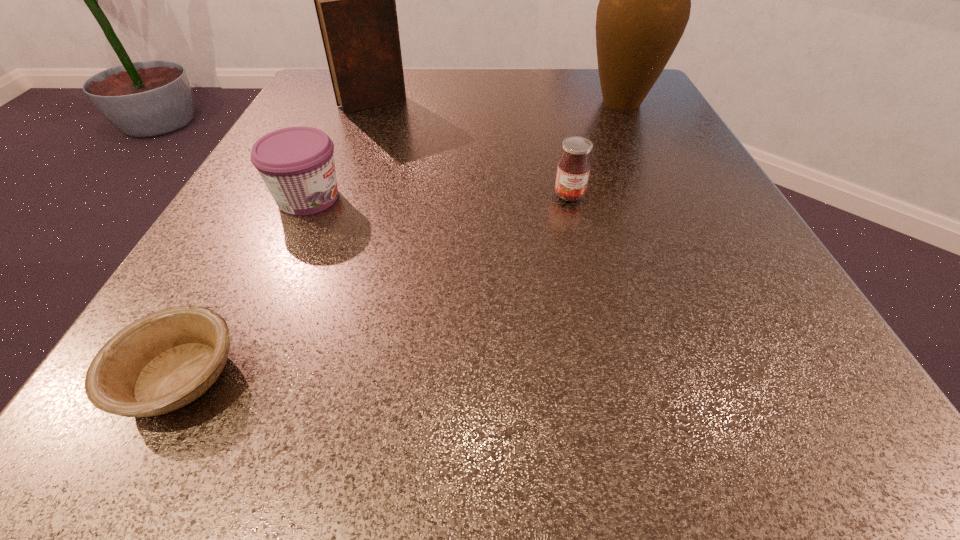
The image size is (960, 540). In order to click on object that is positioned at the near left corner in this screenshot , I will do `click(163, 361)`.

Where is `object that is at the far right corner`? The image size is (960, 540). object that is at the far right corner is located at coordinates (645, 0).

The width and height of the screenshot is (960, 540). I want to click on vacant region at the far edge of the desktop, so click(x=564, y=94).

Locate an element on the screen. This screenshot has width=960, height=540. vacant space at the near edge of the desktop is located at coordinates (359, 435).

In the image, there is a desktop. At what (x,y) coordinates should I click in order to perform the action: click on vacant space at the left edge. Please return your answer as a coordinate pair (x, y). Looking at the image, I should click on click(208, 275).

Identify the location of vacant region at the right edge of the desktop. (660, 124).

Locate an element on the screen. vacant region at the near right corner of the desktop is located at coordinates (696, 396).

Where is `empty space between the fourth shortest object and the bowl`? empty space between the fourth shortest object and the bowl is located at coordinates (276, 240).

Find the location of a particular element. The height and width of the screenshot is (540, 960). free point between the nearest object and the tallest object is located at coordinates (400, 240).

This screenshot has width=960, height=540. Find the location of `vacant space in between the nearest object and the rightmost object`. vacant space in between the nearest object and the rightmost object is located at coordinates coord(400,240).